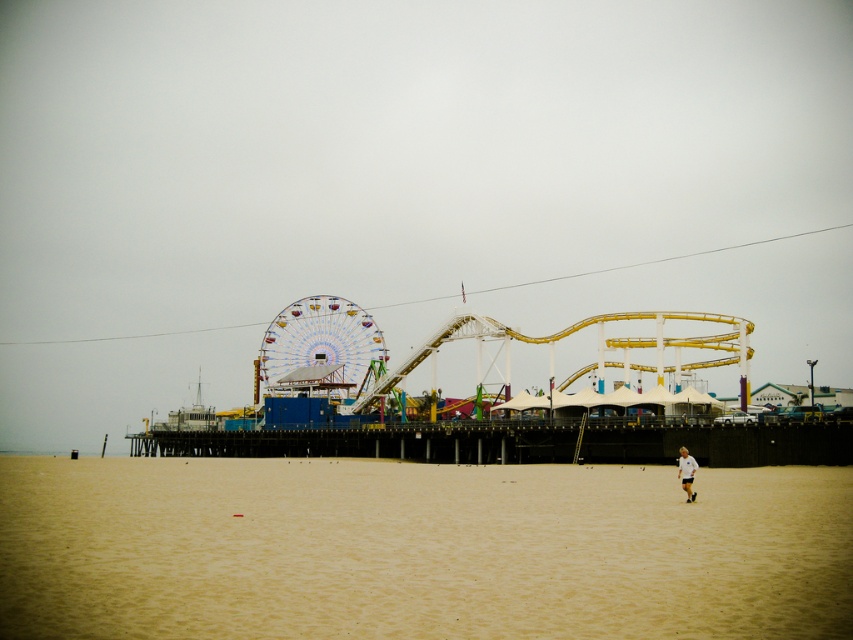
From the picture: Can you confirm if white and blue striped ferris wheel at center is shorter than white fabric person at lower right?

In fact, white and blue striped ferris wheel at center may be taller than white fabric person at lower right.

Is point (268, 355) behind point (682, 481)?

Yes, it is behind point (682, 481).

The height and width of the screenshot is (640, 853). I want to click on white and blue striped ferris wheel at center, so click(320, 340).

Between beige sand at lower center and wooden pier at center, which one is positioned lower?

Positioned lower is wooden pier at center.

Measure the distance between beige sand at lower center and camera.

beige sand at lower center and camera are 41.42 meters apart.

The width and height of the screenshot is (853, 640). Identify the location of beige sand at lower center. (419, 548).

Where is `beige sand at lower center`? This screenshot has width=853, height=640. beige sand at lower center is located at coordinates (419, 548).

Is point (351, 435) positioned in front of point (303, 316)?

Yes, it is in front of point (303, 316).

This screenshot has height=640, width=853. What do you see at coordinates (378, 442) in the screenshot? I see `wooden pier at center` at bounding box center [378, 442].

At what (x,y) coordinates should I click in order to perform the action: click on wooden pier at center. Please return your answer as a coordinate pair (x, y). Looking at the image, I should click on (378, 442).